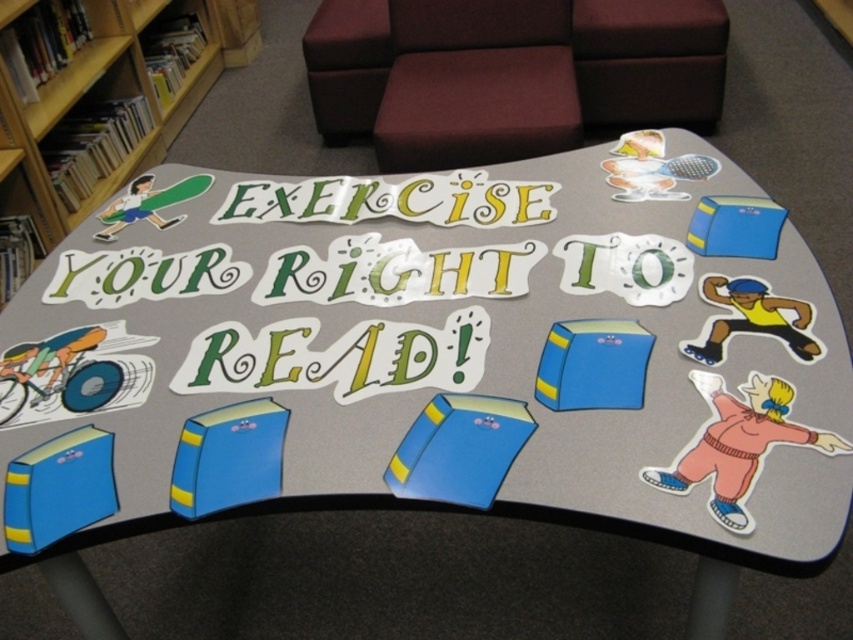
Question: Does smooth leather stool at upper center appear over maroon fabric stool at upper center?

Choices:
 (A) yes
 (B) no

Answer: (B)

Question: In this image, where is velvet-like maroon stool at center located relative to smooth leather stool at upper center?

Choices:
 (A) left
 (B) right

Answer: (A)

Question: Does smooth leather stool at upper center appear over maroon fabric stool at upper center?

Choices:
 (A) yes
 (B) no

Answer: (B)

Question: Which of these objects is positioned farthest from the maroon fabric stool at upper center?

Choices:
 (A) smooth leather stool at upper center
 (B) velvet-like maroon stool at center

Answer: (A)

Question: Which object is closer to the camera taking this photo?

Choices:
 (A) velvet-like maroon stool at center
 (B) smooth leather stool at upper center
 (C) maroon fabric stool at upper center

Answer: (A)

Question: Which of the following is the closest to the observer?

Choices:
 (A) smooth leather stool at upper center
 (B) maroon fabric stool at upper center

Answer: (A)